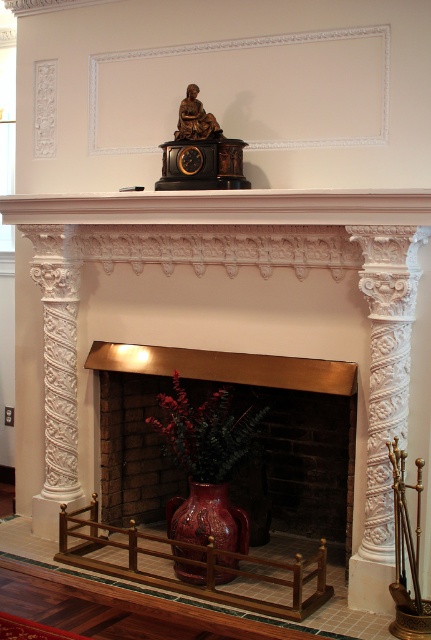
You are an interior designer planning to hang a painting on the wall. The painting is 0.5 meters wide. The white carved wood mantle at upper center is represented by point (224, 208). Where should you place the painting so it doesn

The white carved wood mantle at upper center is located at point (224, 208). To avoid covering the mantle, the painting should be placed either to the left or right of this point, ensuring it does not overlap with the mantle.

You are standing in the room and want to place a 2.5 meter tall painting on the wall where the white carved wood mantle at upper center is located. Can the painting fit vertically without exceeding the mantle height?

The distance between the viewer and the white carved wood mantle at upper center is 3.23 meters, but this measurement refers to the distance from the viewer to the mantle, not the mantle height. The question about the painting fitting vertically cannot be determined with the provided information as the mantle height is not specified.

You are an interior designer planning to place a new decorative item on the mantel. The item you want to place is smaller than the glossy ceramic vase at center. Will it fit on the white carved wood mantle at upper center?

The white carved wood mantle at upper center has a larger size compared to the glossy ceramic vase at center. Since the new decorative item is smaller than the vase, it will fit on the mantle.